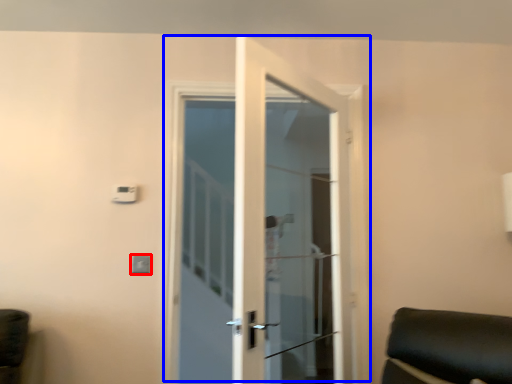
Question: Which point is further to the camera, light switch (highlighted by a red box) or door (highlighted by a blue box)?

Choices:
 (A) light switch
 (B) door

Answer: (A)